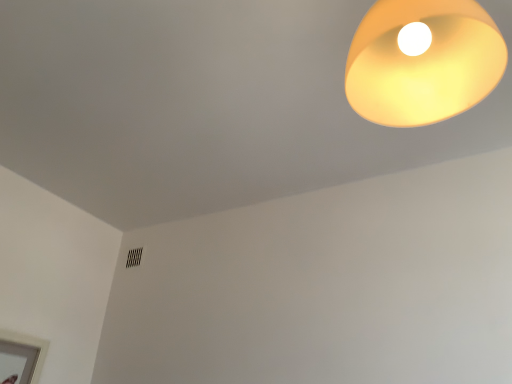
What is the approximate height of matte yellow lampshade at upper right?

The height of matte yellow lampshade at upper right is 18.55 inches.

The width and height of the screenshot is (512, 384). Identify the location of matte yellow lampshade at upper right. (423, 62).

What do you see at coordinates (423, 62) in the screenshot? The height and width of the screenshot is (384, 512). I see `matte yellow lampshade at upper right` at bounding box center [423, 62].

Measure the distance between point (395, 71) and camera.

Point (395, 71) is 37.17 inches away from camera.

The image size is (512, 384). I want to click on matte yellow lampshade at upper right, so click(x=423, y=62).